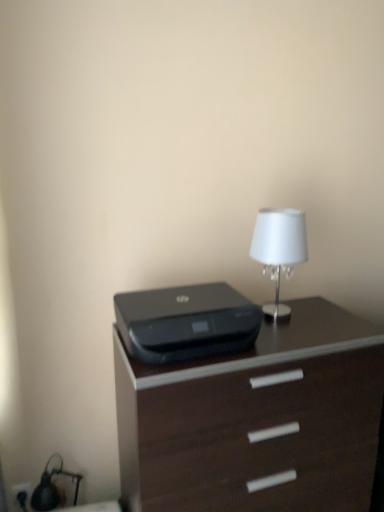
What do you see at coordinates (186, 322) in the screenshot?
I see `black plastic printer at center` at bounding box center [186, 322].

The image size is (384, 512). I want to click on black plastic printer at center, so click(x=186, y=322).

Identify the location of dark wood chest of drawers at center. (257, 420).

What do you see at coordinates (257, 420) in the screenshot?
I see `dark wood chest of drawers at center` at bounding box center [257, 420].

Measure the distance between point [363,481] and camera.

They are 1.59 meters apart.

Locate an element on the screen. The height and width of the screenshot is (512, 384). black plastic printer at center is located at coordinates click(x=186, y=322).

Which object is positioned more to the right, black plastic printer at center or dark wood chest of drawers at center?

Positioned to the right is dark wood chest of drawers at center.

Is black plastic printer at center closer to the viewer compared to dark wood chest of drawers at center?

No, it is behind dark wood chest of drawers at center.

Between point (174, 322) and point (329, 415), which one is positioned behind?

The point (329, 415) is more distant.

From the image's perspective, between black plastic printer at center and dark wood chest of drawers at center, who is located below?

dark wood chest of drawers at center.

From a real-world perspective, which is physically below, black plastic printer at center or dark wood chest of drawers at center?

From a 3D spatial view, dark wood chest of drawers at center is below.

Which object is thinner, black plastic printer at center or dark wood chest of drawers at center?

black plastic printer at center.

In terms of height, does black plastic printer at center look taller or shorter compared to dark wood chest of drawers at center?

In the image, black plastic printer at center appears to be shorter than dark wood chest of drawers at center.

Can you confirm if black plastic printer at center is smaller than dark wood chest of drawers at center?

Yes, black plastic printer at center is smaller than dark wood chest of drawers at center.

Is black plastic printer at center located outside dark wood chest of drawers at center?

black plastic printer at center is positioned outside dark wood chest of drawers at center.

Can you see black plastic printer at center touching dark wood chest of drawers at center?

No, black plastic printer at center is not in contact with dark wood chest of drawers at center.

Does black plastic printer at center turn towards dark wood chest of drawers at center?

No, black plastic printer at center is not aimed at dark wood chest of drawers at center.

Can you tell me how much black plastic printer at center and dark wood chest of drawers at center differ in facing direction?

The facing directions of black plastic printer at center and dark wood chest of drawers at center are 0.0107 degrees apart.

How far apart are black plastic printer at center and dark wood chest of drawers at center?

black plastic printer at center and dark wood chest of drawers at center are 32.02 centimeters apart.

Where is `chest of drawers below the black plastic printer at center (from a real-world perspective)`? chest of drawers below the black plastic printer at center (from a real-world perspective) is located at coordinates (257, 420).

Between dark wood chest of drawers at center and black plastic printer at center, which one appears on the left side from the viewer's perspective?

From the viewer's perspective, black plastic printer at center appears more on the left side.

Is the depth of dark wood chest of drawers at center greater than that of black plastic printer at center?

No, dark wood chest of drawers at center is in front of black plastic printer at center.

Considering the points (129, 499) and (195, 306), which point is behind, point (129, 499) or point (195, 306)?

Point (195, 306)

From the image's perspective, which is above, dark wood chest of drawers at center or black plastic printer at center?

black plastic printer at center, from the image's perspective.

Consider the image. From a real-world perspective, between dark wood chest of drawers at center and black plastic printer at center, who is vertically lower?

In real-world perspective, dark wood chest of drawers at center is lower.

Considering the sizes of dark wood chest of drawers at center and black plastic printer at center in the image, is dark wood chest of drawers at center wider or thinner than black plastic printer at center?

Clearly, dark wood chest of drawers at center has more width compared to black plastic printer at center.

Is dark wood chest of drawers at center taller than black plastic printer at center?

Yes, dark wood chest of drawers at center is taller than black plastic printer at center.

Can you confirm if dark wood chest of drawers at center is smaller than black plastic printer at center?

Incorrect, dark wood chest of drawers at center is not smaller in size than black plastic printer at center.

Is dark wood chest of drawers at center outside of black plastic printer at center?

Indeed, dark wood chest of drawers at center is completely outside black plastic printer at center.

Are dark wood chest of drawers at center and black plastic printer at center beside each other?

dark wood chest of drawers at center and black plastic printer at center are not in contact.

Is dark wood chest of drawers at center facing towards black plastic printer at center?

No, dark wood chest of drawers at center is not facing towards black plastic printer at center.

How many degrees apart are the facing directions of dark wood chest of drawers at center and black plastic printer at center?

They differ by 0.0107 degrees in their facing directions.

The image size is (384, 512). I want to click on printer lying on the left of dark wood chest of drawers at center, so click(x=186, y=322).

Identify the location of chest of drawers that is on the right side of black plastic printer at center. (257, 420).

You are a GUI agent. You are given a task and a screenshot of the screen. Output one action in this format:
    pyautogui.click(x=<x>, y=<y>)
    Task: Click on the printer on the left of dark wood chest of drawers at center
    Image resolution: width=384 pixels, height=512 pixels.
    Given the screenshot: What is the action you would take?
    pyautogui.click(x=186, y=322)